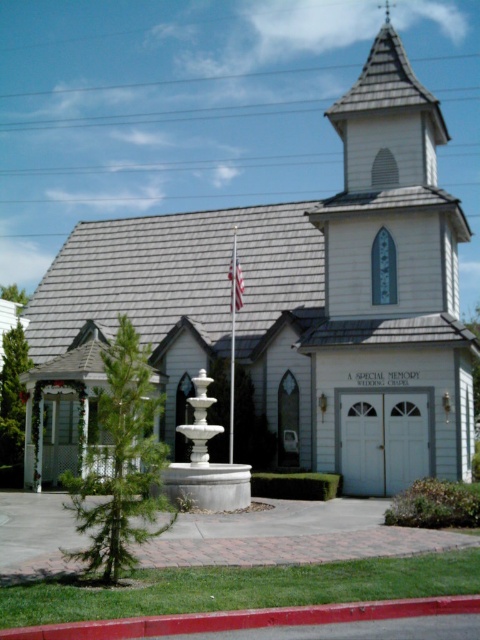
You are standing in front of the chapel and want to determine the relative positions of two points on the building. The first point is at coordinates point [238,305] and the second is at point [230,266]. Which point is closer to you?

Point [238,305] is closer to the viewer than point [230,266].

You are standing in front of the chapel and want to place a small flowerpot exactly where the white glossy flag pole at center is currently located. Is this possible?

The white glossy flag pole at center is located at point (232, 336), so yes, you can place the flowerpot there if the flag pole is removed or relocated first.

You are standing in front of the chapel and notice the white glossy flag pole at center and the white fabric flag at upper center. Which object is bigger in size?

The white glossy flag pole at center is larger in size compared to the white fabric flag at upper center.